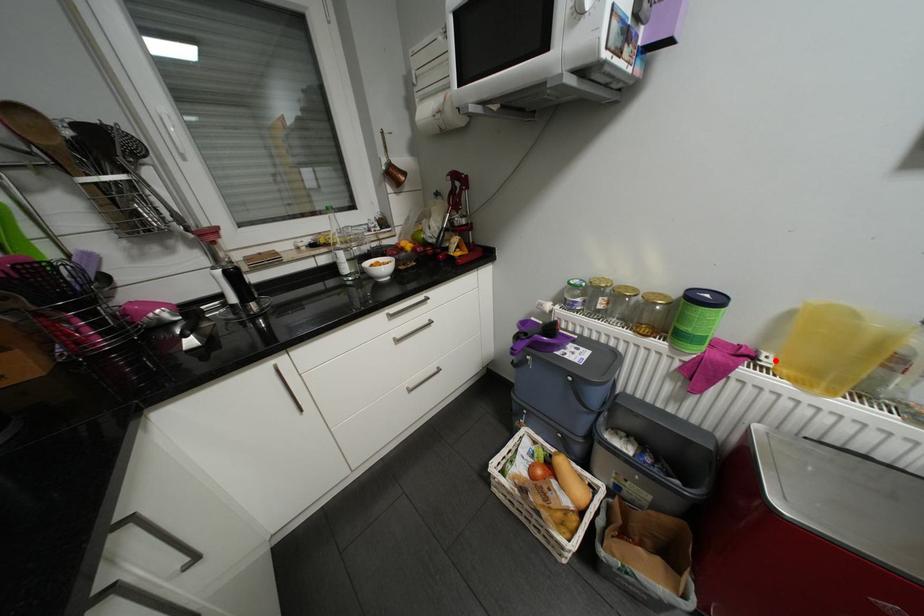
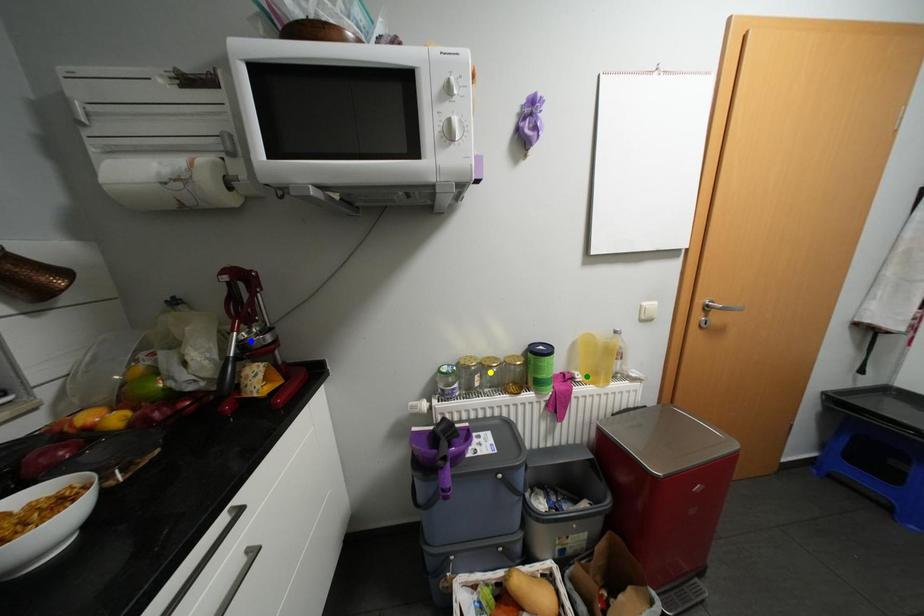
Question: I am providing you with two images of the same scene from different viewpoints. A red point is marked on the first image. You are given multiple points on the second image. In image 2, which mark is for the same physical point as the one in image 1?

Choices:
 (A) green point
 (B) blue point
 (C) yellow point

Answer: (A)